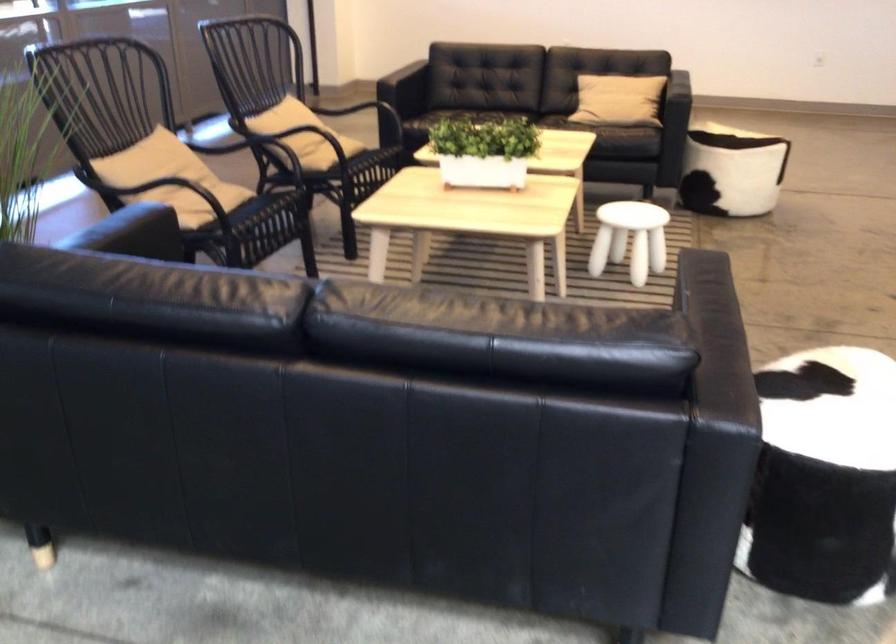
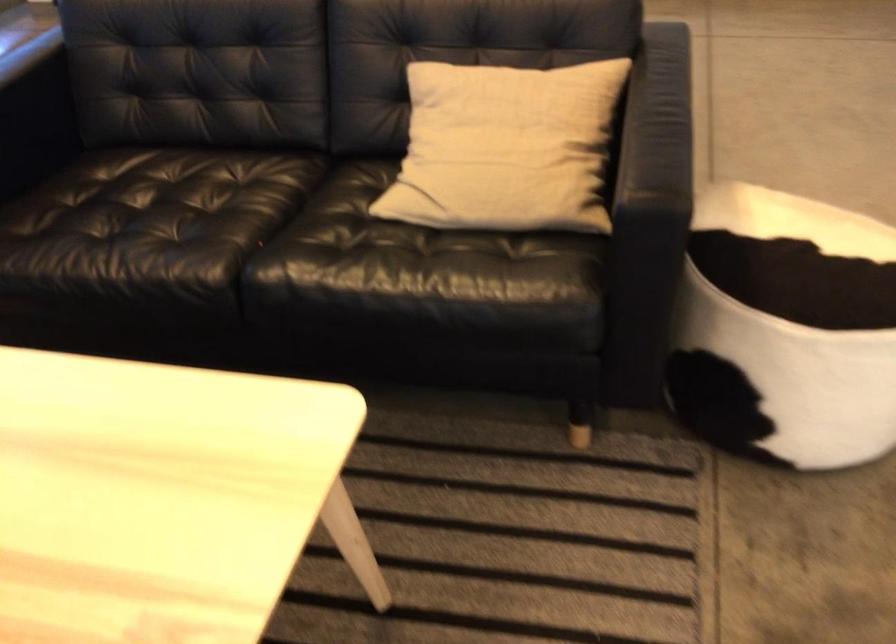
Where in the second image is the point corresponding to pixel 738 97 from the first image?

(693, 69)